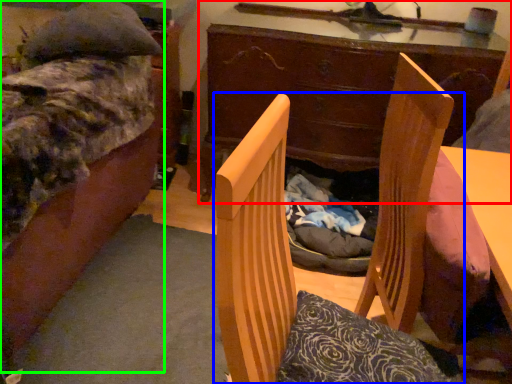
Question: Which object is the closest to the desk (highlighted by a red box)? Choose among these: chair (highlighted by a blue box) or bed (highlighted by a green box).

Choices:
 (A) chair
 (B) bed

Answer: (B)